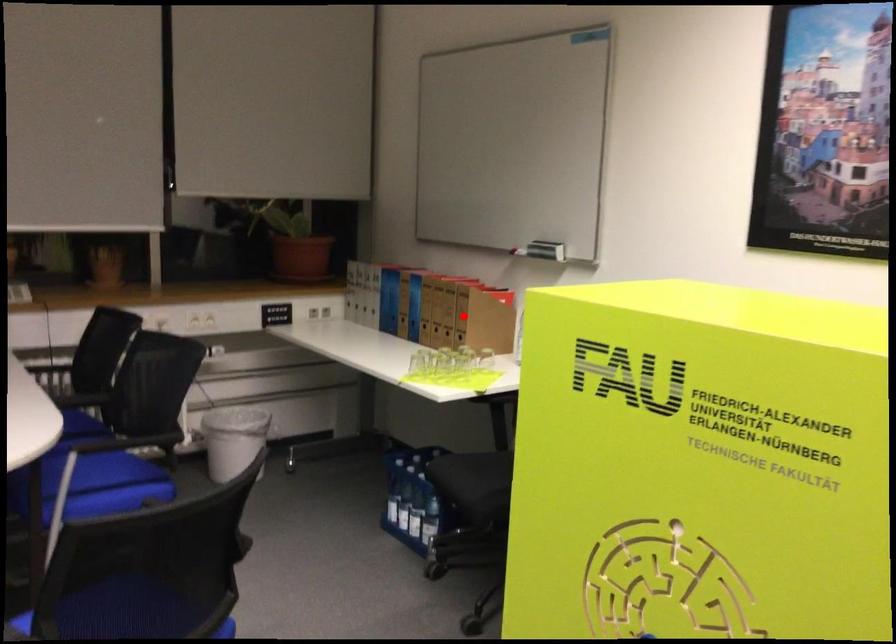
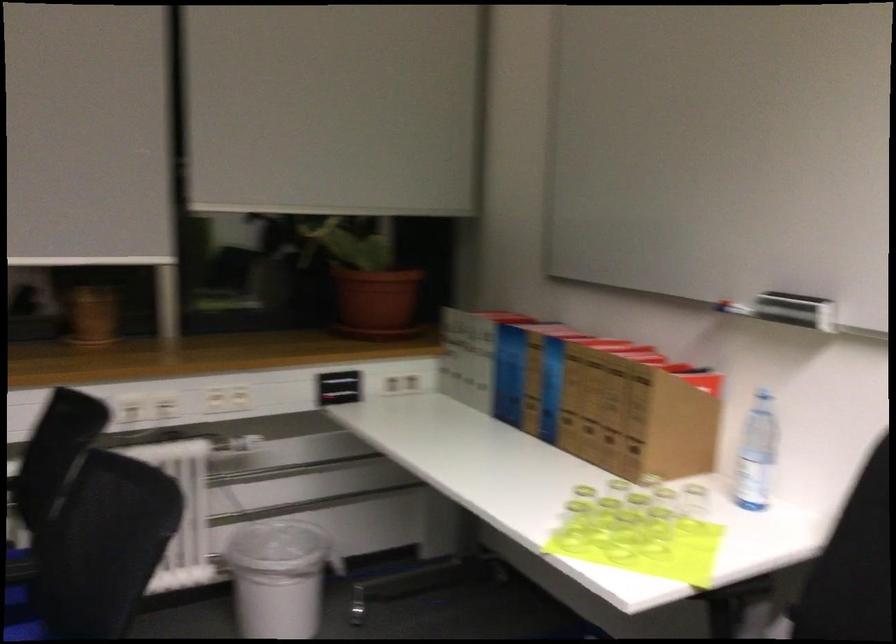
Question: I am providing you with two images of the same scene from different viewpoints. A red point is marked on the first image. At the location where the point appears in image 1, is it still visible in image 2?

Choices:
 (A) Yes
 (B) No

Answer: (A)